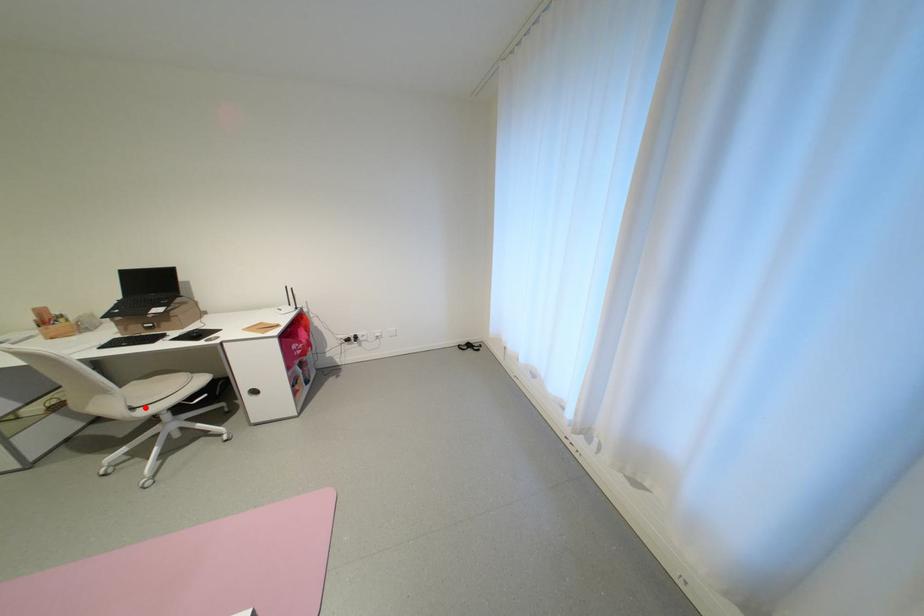
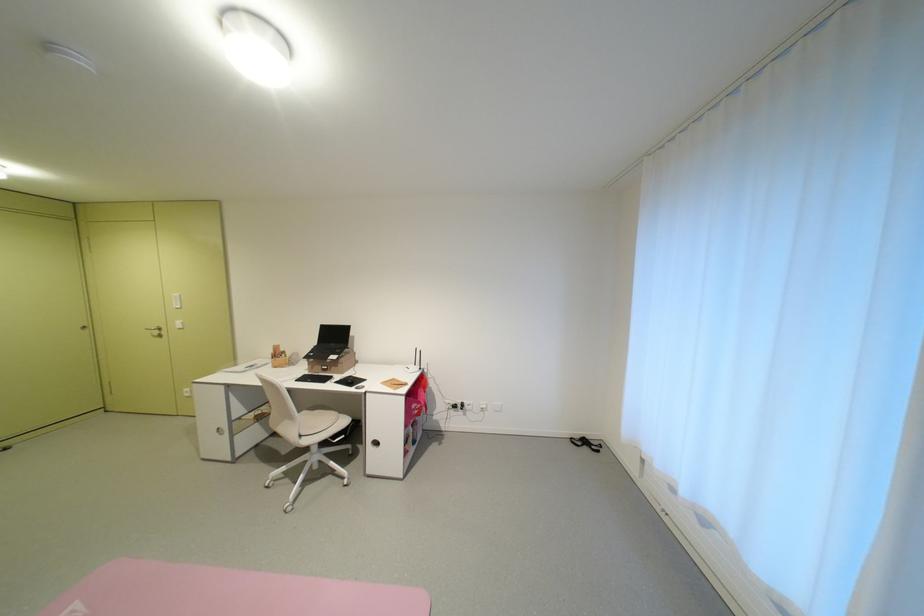
Question: I am providing you with two images of the same scene from different viewpoints. A red point is marked on the first image. Can you still see the location of the red point in image 2?

Choices:
 (A) Yes
 (B) No

Answer: (A)